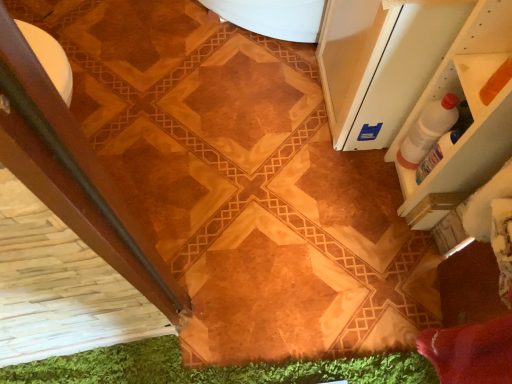
Question: Is point (431, 129) closer or farther from the camera than point (428, 39)?

Choices:
 (A) farther
 (B) closer

Answer: (A)

Question: Is white plastic bottle at upper right inside or outside of white glossy screen door at upper right?

Choices:
 (A) outside
 (B) inside

Answer: (A)

Question: Looking at the image, does white plastic bottle at upper right seem bigger or smaller compared to white glossy screen door at upper right?

Choices:
 (A) small
 (B) big

Answer: (A)

Question: Looking at the image, does white glossy screen door at upper right seem bigger or smaller compared to white plastic bottle at upper right?

Choices:
 (A) small
 (B) big

Answer: (B)

Question: Relative to white plastic bottle at upper right, is white glossy screen door at upper right in front or behind?

Choices:
 (A) front
 (B) behind

Answer: (A)

Question: From the image's perspective, relative to white plastic bottle at upper right, is white glossy screen door at upper right above or below?

Choices:
 (A) above
 (B) below

Answer: (A)

Question: Is white glossy screen door at upper right spatially inside white plastic bottle at upper right, or outside of it?

Choices:
 (A) outside
 (B) inside

Answer: (A)